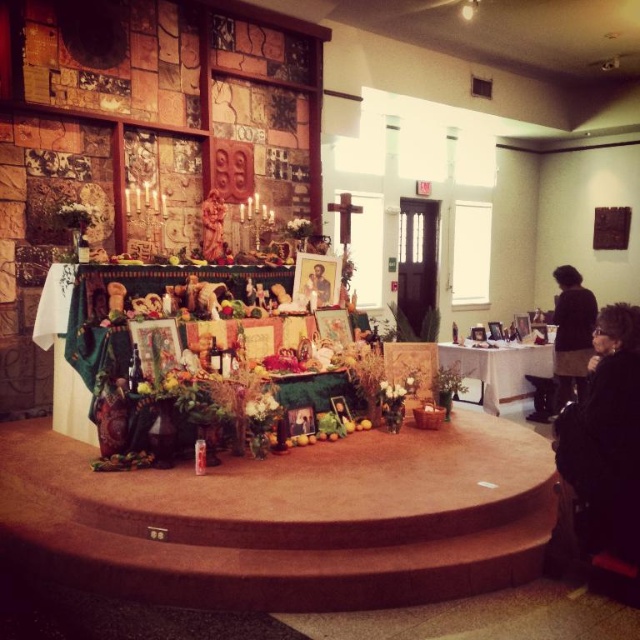
Does point (621, 381) come in front of point (566, 392)?

That is True.

Does black fuzzy coat at lower right have a lesser width compared to black skirt at right?

In fact, black fuzzy coat at lower right might be wider than black skirt at right.

Which is in front, point (600, 332) or point (566, 278)?

Positioned in front is point (600, 332).

The height and width of the screenshot is (640, 640). Identify the location of black fuzzy coat at lower right. (605, 440).

Which is below, wooden statue at center or matte black portrait at center?

matte black portrait at center is lower down.

The width and height of the screenshot is (640, 640). What are the coordinates of `wooden statue at center` in the screenshot? It's located at (212, 227).

Find the location of a particular element. The width and height of the screenshot is (640, 640). wooden statue at center is located at coordinates (212, 227).

Between point (595, 545) and point (205, 204), which one is positioned behind?

Positioned behind is point (205, 204).

Where is `black fuzzy coat at lower right`? black fuzzy coat at lower right is located at coordinates (605, 440).